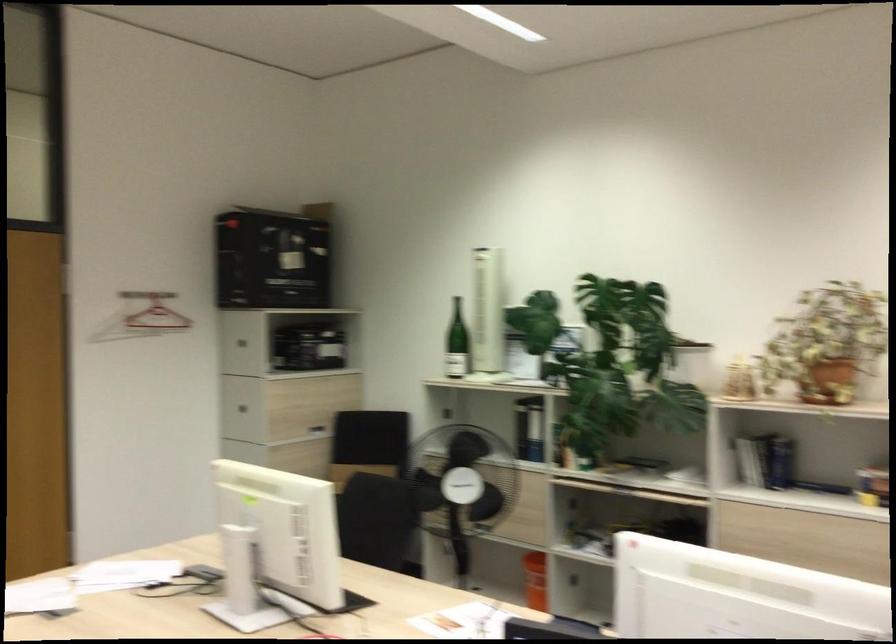
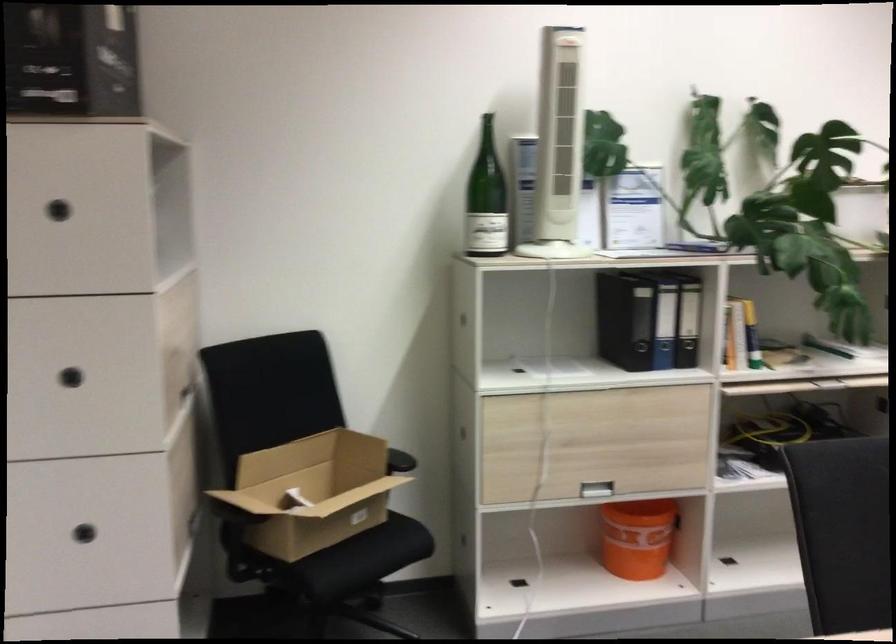
In the second image, find the point that corresponds to the point at 537,574 in the first image.

(636, 538)